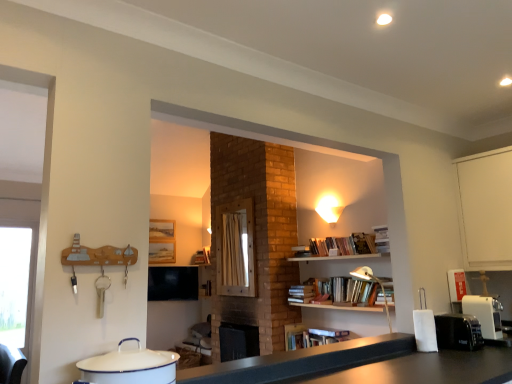
Question: Does metallic silver lamp at upper right have a larger size compared to black matte counter top at center?

Choices:
 (A) no
 (B) yes

Answer: (B)

Question: Considering the relative sizes of metallic silver lamp at upper right and black matte counter top at center in the image provided, is metallic silver lamp at upper right thinner than black matte counter top at center?

Choices:
 (A) no
 (B) yes

Answer: (A)

Question: Can you confirm if metallic silver lamp at upper right is positioned to the right of black matte counter top at center?

Choices:
 (A) yes
 (B) no

Answer: (A)

Question: Is metallic silver lamp at upper right shorter than black matte counter top at center?

Choices:
 (A) no
 (B) yes

Answer: (A)

Question: Is metallic silver lamp at upper right located outside black matte counter top at center?

Choices:
 (A) yes
 (B) no

Answer: (A)

Question: Is point (320, 210) closer or farther from the camera than point (464, 309)?

Choices:
 (A) farther
 (B) closer

Answer: (A)

Question: Looking at their shapes, would you say matte white lampshade at upper center is wider or thinner than white plastic coffee machine at lower right?

Choices:
 (A) wide
 (B) thin

Answer: (B)

Question: From a real-world perspective, is matte white lampshade at upper center positioned above or below white plastic coffee machine at lower right?

Choices:
 (A) below
 (B) above

Answer: (B)

Question: In terms of height, does matte white lampshade at upper center look taller or shorter compared to white plastic coffee machine at lower right?

Choices:
 (A) tall
 (B) short

Answer: (B)

Question: From a real-world perspective, is black plastic toaster at right, arranged as the 1th appliance when viewed from the back, physically located above or below metallic silver lamp at upper right?

Choices:
 (A) below
 (B) above

Answer: (A)

Question: Considering their positions, is black plastic toaster at right, the 2th appliance viewed from the top, located in front of or behind metallic silver lamp at upper right?

Choices:
 (A) front
 (B) behind

Answer: (A)

Question: Considering the positions of black plastic toaster at right, the second appliance when ordered from front to back, and metallic silver lamp at upper right in the image, is black plastic toaster at right, the second appliance when ordered from front to back, wider or thinner than metallic silver lamp at upper right?

Choices:
 (A) thin
 (B) wide

Answer: (A)

Question: Based on their positions, is black plastic toaster at right, the 2th appliance viewed from the top, located to the left or right of metallic silver lamp at upper right?

Choices:
 (A) left
 (B) right

Answer: (B)

Question: In terms of size, does metallic silver lamp at upper right appear bigger or smaller than wooden frame at center?

Choices:
 (A) small
 (B) big

Answer: (A)

Question: Is metallic silver lamp at upper right situated inside wooden frame at center or outside?

Choices:
 (A) inside
 (B) outside

Answer: (B)